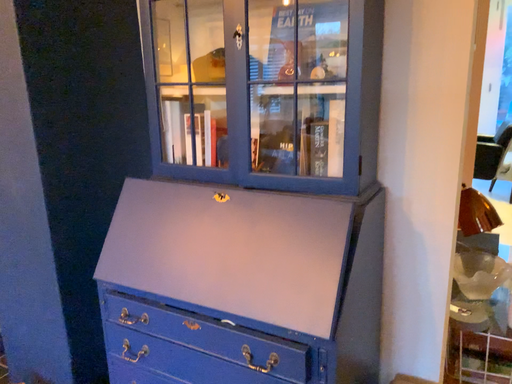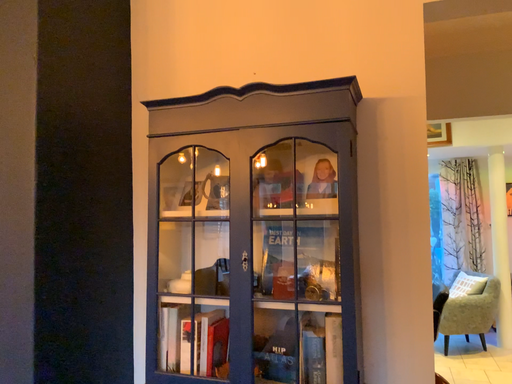
Question: How did the camera likely rotate when shooting the video?

Choices:
 (A) rotated left
 (B) rotated right

Answer: (B)